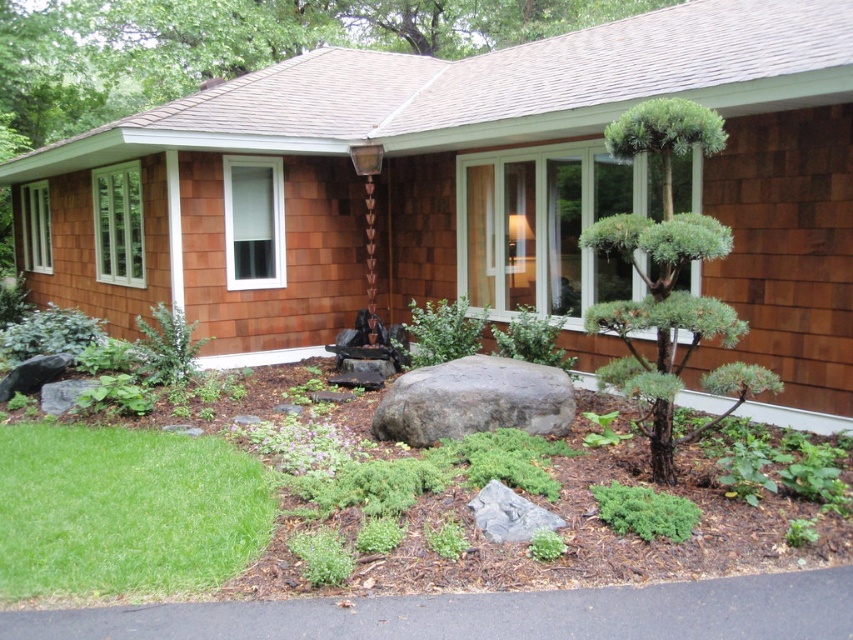
Question: Is green grass at lower left in front of gray rough boulder at center?

Choices:
 (A) no
 (B) yes

Answer: (B)

Question: Is green needle-like at center bigger than gray rough boulder at center?

Choices:
 (A) yes
 (B) no

Answer: (A)

Question: Is green grass at lower left behind green needle-like at center?

Choices:
 (A) yes
 (B) no

Answer: (B)

Question: Which of the following is the closest to the observer?

Choices:
 (A) gray rough boulder at center
 (B) green grass at lower left
 (C) green needle-like at center

Answer: (B)

Question: Which point appears farthest from the camera in this image?

Choices:
 (A) (486, 422)
 (B) (624, 221)

Answer: (A)

Question: Among these objects, which one is nearest to the camera?

Choices:
 (A) gray rough boulder at center
 (B) green needle-like at center

Answer: (B)